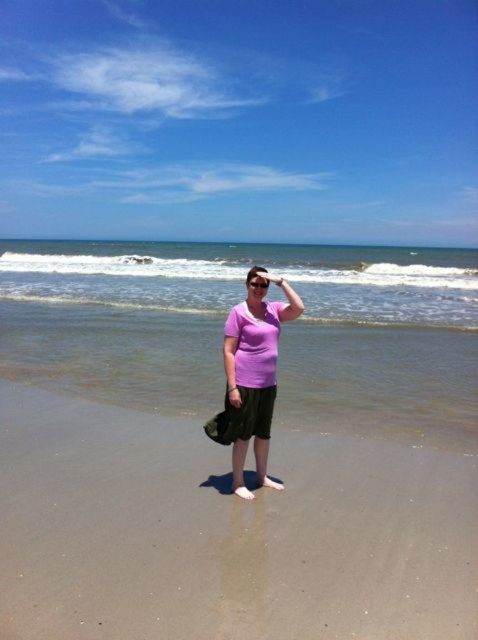
Question: Is pink matte shirt at center above transparent plastic goggles at center?

Choices:
 (A) yes
 (B) no

Answer: (B)

Question: Which point is closer to the camera?

Choices:
 (A) (258, 282)
 (B) (153, 276)

Answer: (A)

Question: Which of the following is the farthest from the observer?

Choices:
 (A) transparent plastic goggles at center
 (B) blue water at center
 (C) smooth sand at center
 (D) pink matte shirt at center

Answer: (B)

Question: Which object appears farthest from the camera in this image?

Choices:
 (A) blue water at center
 (B) smooth sand at center
 (C) pink matte shirt at center
 (D) transparent plastic goggles at center

Answer: (A)

Question: Can you confirm if blue water at center is wider than pink matte shirt at center?

Choices:
 (A) no
 (B) yes

Answer: (B)

Question: In this image, where is blue water at center located relative to transparent plastic goggles at center?

Choices:
 (A) above
 (B) below

Answer: (A)